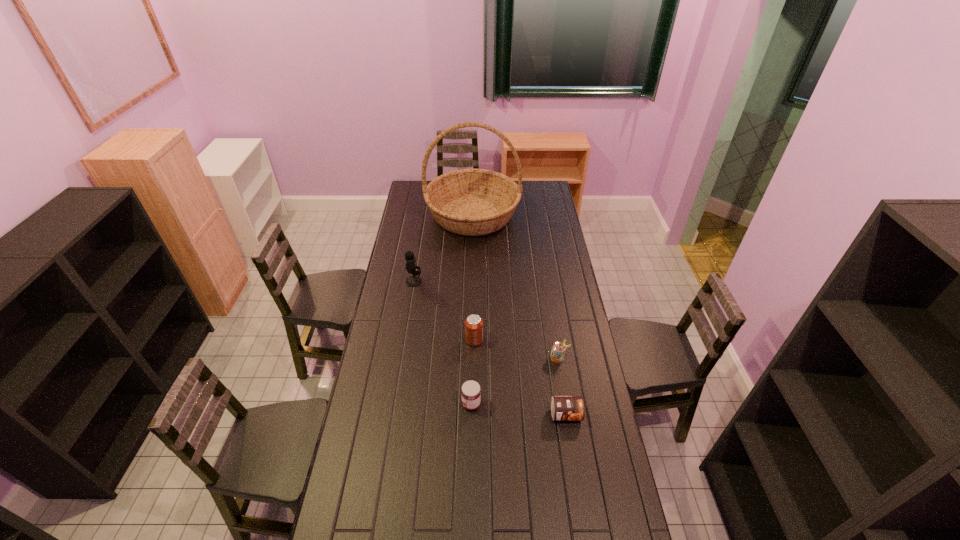
Locate an element on the screen. This screenshot has width=960, height=540. blank space that satisfies the following two spatial constraints: 1. on the front side of the jam; 2. on the right side of the farthest object is located at coordinates point(468,404).